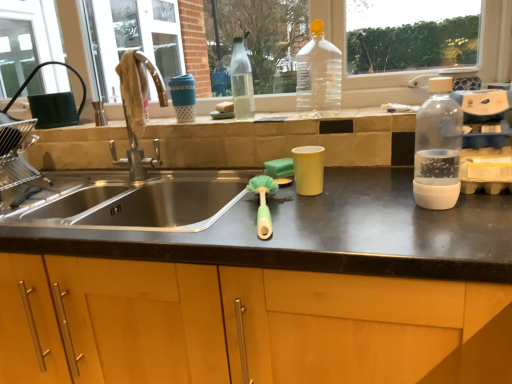
Identify the location of stainless steel sink at center. The width and height of the screenshot is (512, 384). point(138,206).

The height and width of the screenshot is (384, 512). I want to click on transparent plastic bottle at center, acting as the third bottle starting from the front, so [x=241, y=81].

In order to face transparent plastic bottle at upper center, arranged as the second bottle when viewed from the left, should I rotate leftwards or rightwards?

Turn right by 8.337 degrees to look at transparent plastic bottle at upper center, arranged as the second bottle when viewed from the left.

At what (x,y) coordinates should I click in order to perform the action: click on stainless steel sink at center. Please return your answer as a coordinate pair (x, y). Looking at the image, I should click on (138, 206).

Is stainless steel sink at center shorter than transparent plastic bottle at center, acting as the third bottle starting from the front?

In fact, stainless steel sink at center may be taller than transparent plastic bottle at center, acting as the third bottle starting from the front.

Which object is further away from the camera taking this photo, stainless steel sink at center or transparent plastic bottle at center, acting as the third bottle starting from the front?

transparent plastic bottle at center, acting as the third bottle starting from the front, is more distant.

Which point is more forward, (x=129, y=129) or (x=234, y=63)?

The point (x=129, y=129) is in front.

In the scene shown: Considering the positions of objects transparent plastic bottle at right, acting as the third bottle starting from the left, and transparent plastic bottle at center, the 1th bottle positioned from the left, in the image provided, who is more to the left, transparent plastic bottle at right, acting as the third bottle starting from the left, or transparent plastic bottle at center, the 1th bottle positioned from the left,?

Positioned to the left is transparent plastic bottle at center, the 1th bottle positioned from the left.

Could you tell me if transparent plastic bottle at right, which is the third bottle from back to front, is facing transparent plastic bottle at center, positioned as the third bottle in right-to-left order?

No, transparent plastic bottle at right, which is the third bottle from back to front, is not oriented towards transparent plastic bottle at center, positioned as the third bottle in right-to-left order.

From a real-world perspective, is transparent plastic bottle at right, the first bottle from the right, above or below transparent plastic bottle at center, the 1th bottle positioned from the left?

transparent plastic bottle at right, the first bottle from the right, is below transparent plastic bottle at center, the 1th bottle positioned from the left.

Does transparent plastic bottle at right, the first bottle from the front, touch transparent plastic bottle at center, positioned as the third bottle in right-to-left order?

transparent plastic bottle at right, the first bottle from the front, and transparent plastic bottle at center, positioned as the third bottle in right-to-left order, are clearly separated.

Would you say stainless steel sink at center is to the left or to the right of green sponge at center in the picture?

Based on their positions, stainless steel sink at center is located to the left of green sponge at center.

Are stainless steel sink at center and green sponge at center making contact?

There is a gap between stainless steel sink at center and green sponge at center.

From a real-world perspective, who is located lower, stainless steel sink at center or green sponge at center?

green sponge at center is physically lower.

Do you think stainless steel sink at center is within green sponge at center, or outside of it?

The correct answer is: outside.

Does green rubber brush at center have a lesser width compared to transparent plastic bottle at upper center, arranged as the second bottle when viewed from the left?

Incorrect, the width of green rubber brush at center is not less than that of transparent plastic bottle at upper center, arranged as the second bottle when viewed from the left.

Considering the relative positions of green rubber brush at center and transparent plastic bottle at upper center, which appears as the 2th bottle when viewed from the back, in the image provided, is green rubber brush at center to the left or to the right of transparent plastic bottle at upper center, which appears as the 2th bottle when viewed from the back,?

Clearly, green rubber brush at center is on the left of transparent plastic bottle at upper center, which appears as the 2th bottle when viewed from the back, in the image.

Is transparent plastic bottle at upper center, which appears as the 2th bottle when viewed from the back, inside green rubber brush at center?

No.

How many degrees apart are the facing directions of transparent plastic bottle at upper center, which appears as the 2th bottle when viewed from the back, and transparent plastic bottle at right, the first bottle from the front?

91.5 degrees separate the facing orientations of transparent plastic bottle at upper center, which appears as the 2th bottle when viewed from the back, and transparent plastic bottle at right, the first bottle from the front.

Between transparent plastic bottle at upper center, arranged as the second bottle when viewed from the left, and transparent plastic bottle at right, acting as the third bottle starting from the left, which one appears on the right side from the viewer's perspective?

From the viewer's perspective, transparent plastic bottle at right, acting as the third bottle starting from the left, appears more on the right side.

Does transparent plastic bottle at upper center, arranged as the second bottle when viewed from the left, have a greater height compared to transparent plastic bottle at right, the first bottle from the right?

Correct, transparent plastic bottle at upper center, arranged as the second bottle when viewed from the left, is much taller as transparent plastic bottle at right, the first bottle from the right.

Is transparent plastic bottle at right, acting as the third bottle starting from the left, at the back of transparent plastic bottle at upper center, which is counted as the second bottle, starting from the front?

No, transparent plastic bottle at right, acting as the third bottle starting from the left, is not at the back of transparent plastic bottle at upper center, which is counted as the second bottle, starting from the front.

From the image's perspective, is transparent plastic bottle at right, acting as the third bottle starting from the left, located beneath green sponge at center?

Actually, transparent plastic bottle at right, acting as the third bottle starting from the left, appears above green sponge at center in the image.

Choose the correct answer: Is transparent plastic bottle at right, the first bottle from the right, inside green sponge at center or outside it?

The correct answer is: outside.

Are transparent plastic bottle at right, the first bottle from the front, and green sponge at center beside each other?

No, transparent plastic bottle at right, the first bottle from the front, is not making contact with green sponge at center.

Identify the location of soap below the transparent plastic bottle at right, the first bottle from the front (from the image's perspective). The height and width of the screenshot is (384, 512). (279, 168).

Consider the image. Considering the sizes of transparent plastic bottle at upper center, which is counted as the second bottle, starting from the front, and transparent plastic bottle at center, acting as the third bottle starting from the front, in the image, is transparent plastic bottle at upper center, which is counted as the second bottle, starting from the front, wider or thinner than transparent plastic bottle at center, acting as the third bottle starting from the front,?

transparent plastic bottle at upper center, which is counted as the second bottle, starting from the front, is wider than transparent plastic bottle at center, acting as the third bottle starting from the front.

Between transparent plastic bottle at upper center, which appears as the 2th bottle when viewed from the back, and transparent plastic bottle at center, acting as the third bottle starting from the front, which one is positioned behind?

transparent plastic bottle at center, acting as the third bottle starting from the front.

Is transparent plastic bottle at upper center, which appears as the 2th bottle when viewed from the back, not within transparent plastic bottle at center, positioned as the third bottle in right-to-left order?

transparent plastic bottle at upper center, which appears as the 2th bottle when viewed from the back, is positioned outside transparent plastic bottle at center, positioned as the third bottle in right-to-left order.

From a real-world perspective, is transparent plastic bottle at upper center, arranged as the second bottle when viewed from the left, on transparent plastic bottle at center, the 1th bottle positioned from the left?

Correct, in the physical world, transparent plastic bottle at upper center, arranged as the second bottle when viewed from the left, is higher than transparent plastic bottle at center, the 1th bottle positioned from the left.

At what (x,y) coordinates should I click in order to perform the action: click on sink below the transparent plastic bottle at center, which is the 1th bottle in back-to-front order (from the image's perspective). Please return your answer as a coordinate pair (x, y). The height and width of the screenshot is (384, 512). Looking at the image, I should click on click(138, 206).

Which bottle is the 2nd one when counting from the front of the transparent plastic bottle at center, acting as the third bottle starting from the front? Please provide its 2D coordinates.

[(438, 148)]

Considering their positions, is wooden cabinet at center positioned closer to green rubber brush at center than transparent plastic bottle at upper center, arranged as the second bottle when viewed from the left?

wooden cabinet at center is positioned closer to the anchor green rubber brush at center.

From the picture: When comparing their distances from wooden cabinet at center, does green sponge at center or transparent plastic bottle at center, acting as the third bottle starting from the front, seem further?

Among the two, transparent plastic bottle at center, acting as the third bottle starting from the front, is located further to wooden cabinet at center.

When comparing their distances from transparent plastic bottle at center, positioned as the third bottle in right-to-left order, does wooden cabinet at center or green rubber brush at center seem closer?

Based on the image, green rubber brush at center appears to be nearer to transparent plastic bottle at center, positioned as the third bottle in right-to-left order.

Consider the image. Looking at the image, which one is located closer to green sponge at center, transparent plastic bottle at right, which is the third bottle from back to front, or stainless steel sink at center?

transparent plastic bottle at right, which is the third bottle from back to front, is positioned closer to the anchor green sponge at center.

Looking at this image, when comparing their distances from wooden cabinet at center, does green sponge at center or transparent plastic bottle at upper center, which appears as the second bottle when viewed from the right, seem closer?

Based on the image, green sponge at center appears to be nearer to wooden cabinet at center.

From the image, which object appears to be nearer to transparent plastic bottle at center, the 1th bottle positioned from the left, green sponge at center or green rubber brush at center?

green sponge at center is positioned closer to the anchor transparent plastic bottle at center, the 1th bottle positioned from the left.

Which object lies nearer to the anchor point stainless steel sink at center, green sponge at center or transparent plastic bottle at upper center, which is counted as the second bottle, starting from the front?

The object closer to stainless steel sink at center is green sponge at center.

Considering their positions, is wooden cabinet at center positioned further to green rubber brush at center than transparent plastic bottle at right, the first bottle from the front?

transparent plastic bottle at right, the first bottle from the front.

This screenshot has width=512, height=384. Identify the location of brush between transparent plastic bottle at upper center, arranged as the second bottle when viewed from the left, and wooden cabinet at center vertically. (263, 203).

Identify the location of bottle between stainless steel sink at center and transparent plastic bottle at upper center, which appears as the 2th bottle when viewed from the back, in the horizontal direction. This screenshot has height=384, width=512. click(241, 81).

Locate an element on the screen. The width and height of the screenshot is (512, 384). brush between wooden cabinet at center and transparent plastic bottle at right, the first bottle from the right, from left to right is located at coordinates (263, 203).

At what (x,y) coordinates should I click in order to perform the action: click on cabinetry between stainless steel sink at center and transparent plastic bottle at right, which is the third bottle from back to front, from left to right. Please return your answer as a coordinate pair (x, y). Looking at the image, I should click on (243, 325).